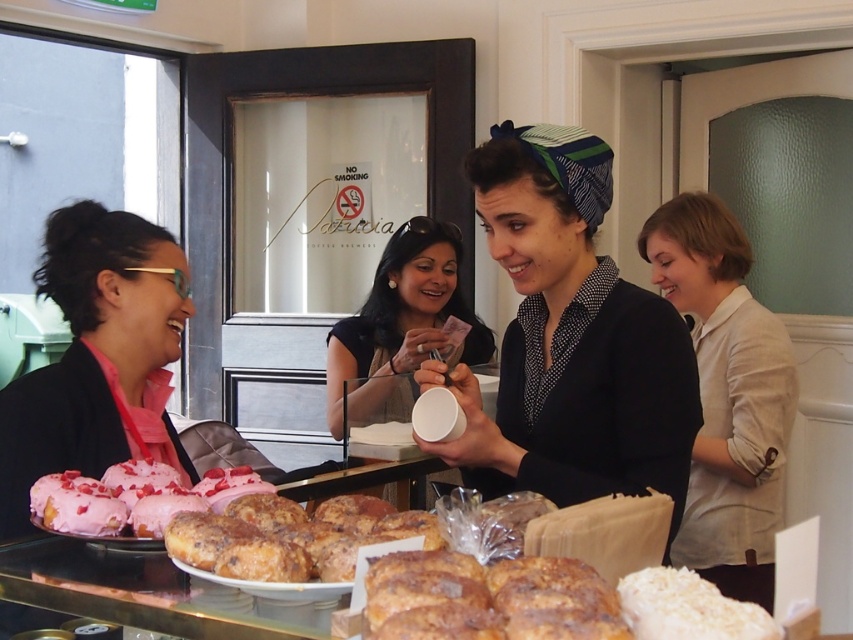
From the picture: Between polka dot blouse at center and cinnamon-sugar donuts at lower center, which one appears on the left side from the viewer's perspective?

From the viewer's perspective, cinnamon-sugar donuts at lower center appears more on the left side.

Is point (645, 451) positioned behind point (343, 538)?

Yes, it is behind point (343, 538).

In order to click on polka dot blouse at center in this screenshot , I will do [x=572, y=339].

Which is more to the left, polka dot blouse at center or white coconut-coated donut at center?

polka dot blouse at center

Looking at this image, who is shorter, polka dot blouse at center or white coconut-coated donut at center?

white coconut-coated donut at center

Where is `polka dot blouse at center`? This screenshot has width=853, height=640. polka dot blouse at center is located at coordinates (572, 339).

The height and width of the screenshot is (640, 853). I want to click on polka dot blouse at center, so click(x=572, y=339).

Can you confirm if light beige shirt at right is smaller than cinnamon-sugar donuts at lower center?

No, light beige shirt at right is not smaller than cinnamon-sugar donuts at lower center.

Where is `light beige shirt at right`? light beige shirt at right is located at coordinates (726, 394).

The width and height of the screenshot is (853, 640). Identify the location of light beige shirt at right. 726,394.